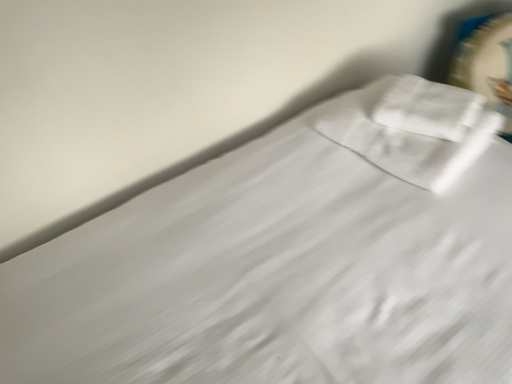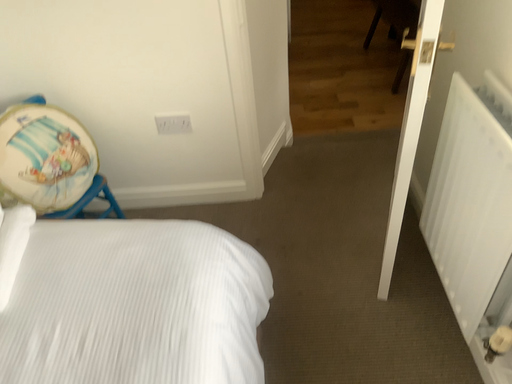
Question: Which way did the camera rotate in the video?

Choices:
 (A) rotated upward
 (B) rotated downward

Answer: (A)